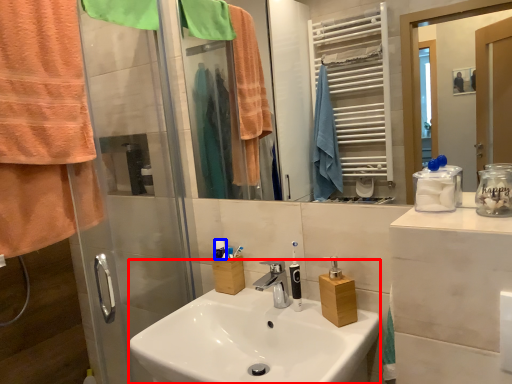
Question: Which object appears farthest to the camera in this image, sink (highlighted by a red box) or toiletries (highlighted by a blue box)?

Choices:
 (A) sink
 (B) toiletries

Answer: (B)